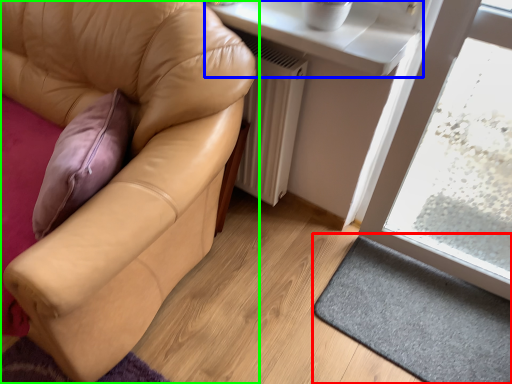
Question: Considering the real-world distances, which object is farthest from doormat (highlighted by a red box)? window sill (highlighted by a blue box) or studio couch (highlighted by a green box)?

Choices:
 (A) window sill
 (B) studio couch

Answer: (A)